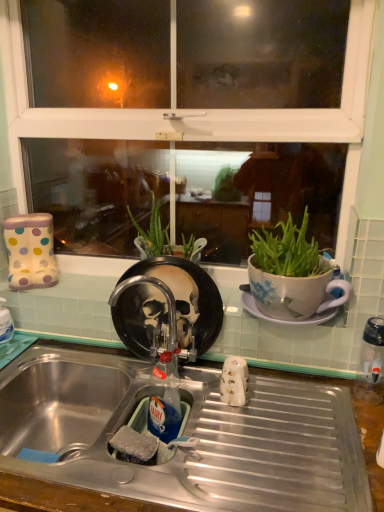
Image resolution: width=384 pixels, height=512 pixels. I want to click on vacant area to the left of clear plastic water bottle at right, so click(x=309, y=410).